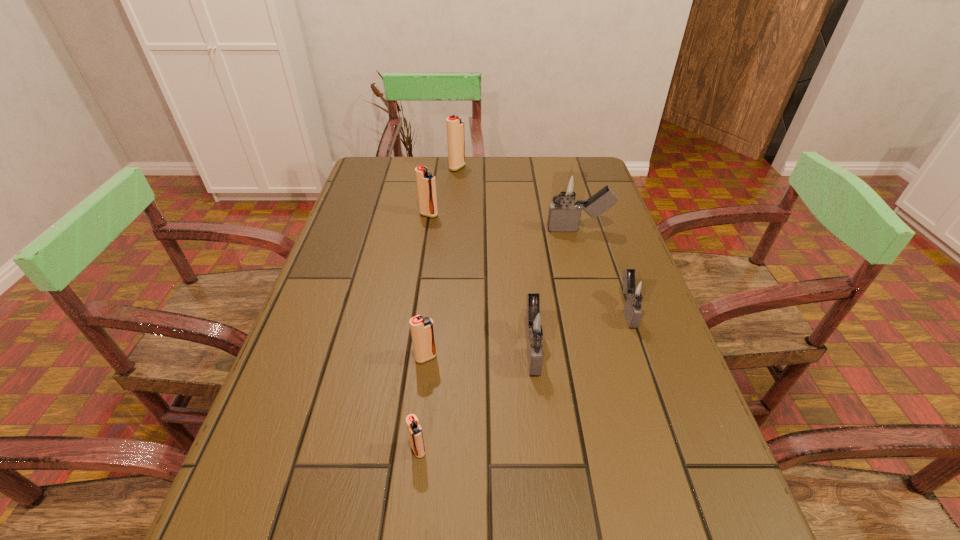
Point out which object is positioned as the sixth nearest to the second smallest gray igniter. Please provide its 2D coordinates. Your answer should be formatted as a tuple, i.e. [(x, y)], where the tuple contains the x and y coordinates of a point satisfying the conditions above.

[(455, 127)]

What are the coordinates of `object that stands as the second closest to the smallest gray igniter` in the screenshot? It's located at (564, 214).

Where is `igniter that can be found as the third closest to the nearest red igniter`? igniter that can be found as the third closest to the nearest red igniter is located at coordinates (636, 290).

Select which igniter is the second closest to the farthest igniter. Please provide its 2D coordinates. Your answer should be formatted as a tuple, i.e. [(x, y)], where the tuple contains the x and y coordinates of a point satisfying the conditions above.

[(564, 214)]

This screenshot has width=960, height=540. I want to click on the third closest red igniter to the biggest red igniter, so click(414, 430).

Point out which red igniter is positioned as the third nearest to the second smallest gray igniter. Please provide its 2D coordinates. Your answer should be formatted as a tuple, i.e. [(x, y)], where the tuple contains the x and y coordinates of a point satisfying the conditions above.

[(426, 186)]

The image size is (960, 540). I want to click on gray igniter that can be found as the second closest to the nearest object, so click(636, 290).

Find the location of a particular element. This screenshot has height=540, width=960. gray igniter that is the second closest to the third object from right to left is located at coordinates (564, 214).

Identify the location of free spot that satisfies the following two spatial constraints: 1. on the front side of the leftmost gray igniter; 2. on the left side of the second biggest red igniter. (408, 348).

At what (x,y) coordinates should I click in order to perform the action: click on vacant point that satisfies the following two spatial constraints: 1. on the front side of the fifth igniter from left to right; 2. on the right side of the farthest object. Please return your answer as a coordinate pair (x, y). Image resolution: width=960 pixels, height=540 pixels. Looking at the image, I should click on (443, 348).